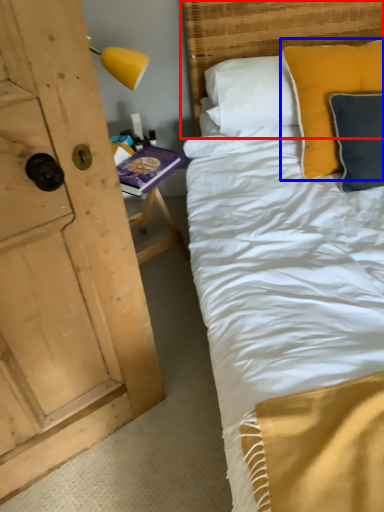
Question: Which object appears farthest to the camera in this image, headboard (highlighted by a red box) or pillow (highlighted by a blue box)?

Choices:
 (A) headboard
 (B) pillow

Answer: (A)